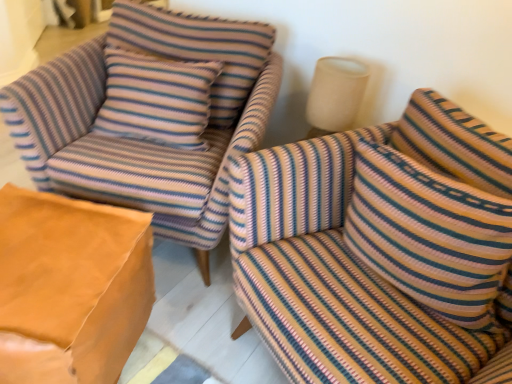
Question: Is striped fabric armchair at upper left completely or partially inside striped fabric couch at right?

Choices:
 (A) no
 (B) yes

Answer: (A)

Question: Is striped fabric couch at right facing away from striped fabric armchair at upper left?

Choices:
 (A) yes
 (B) no

Answer: (B)

Question: From the image's perspective, is striped fabric couch at right on top of striped fabric armchair at upper left?

Choices:
 (A) no
 (B) yes

Answer: (A)

Question: Is striped fabric couch at right behind striped fabric armchair at upper left?

Choices:
 (A) no
 (B) yes

Answer: (A)

Question: Does striped fabric couch at right have a greater height compared to striped fabric armchair at upper left?

Choices:
 (A) no
 (B) yes

Answer: (A)

Question: From the image's perspective, does striped fabric couch at right appear lower than striped fabric armchair at upper left?

Choices:
 (A) yes
 (B) no

Answer: (A)

Question: Is leather-like tan ottoman at lower left far away from striped fabric pillow at right?

Choices:
 (A) no
 (B) yes

Answer: (A)

Question: Does leather-like tan ottoman at lower left appear on the left side of striped fabric pillow at right?

Choices:
 (A) no
 (B) yes

Answer: (B)

Question: Can you confirm if leather-like tan ottoman at lower left is smaller than striped fabric pillow at right?

Choices:
 (A) no
 (B) yes

Answer: (A)

Question: Is striped fabric pillow at right a part of leather-like tan ottoman at lower left?

Choices:
 (A) yes
 (B) no

Answer: (B)

Question: From a real-world perspective, is leather-like tan ottoman at lower left on top of striped fabric pillow at right?

Choices:
 (A) no
 (B) yes

Answer: (A)

Question: Does leather-like tan ottoman at lower left lie in front of striped fabric pillow at right?

Choices:
 (A) yes
 (B) no

Answer: (B)

Question: Is striped fabric armchair at upper left bigger than striped fabric couch at right?

Choices:
 (A) yes
 (B) no

Answer: (A)